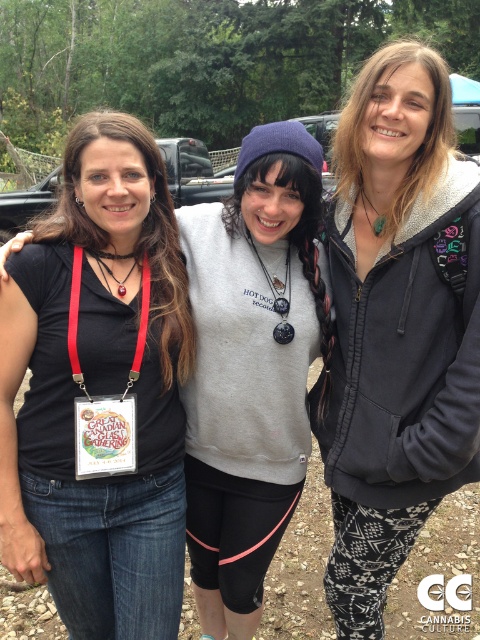
You are a photographer at the event and need to adjust the lighting to ensure the red fabric lanyard at center and the matte red lanyard at center are both clearly visible. Since one is positioned below the other, which lanyard would you focus on first to ensure proper exposure?

The matte red lanyard at center should be focused on first because the red fabric lanyard at center is below it, and adjusting exposure for the upper lanyard ensures the lower one also gets adequate light.